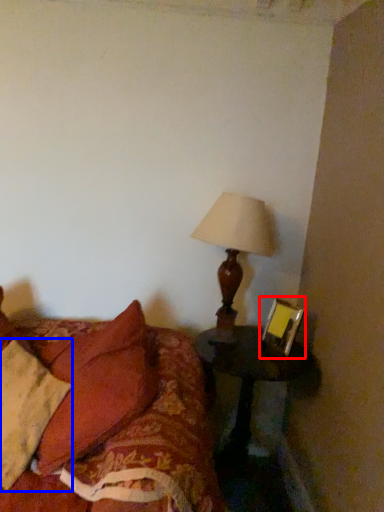
Question: Which object appears farthest to the camera in this image, picture frame (highlighted by a red box) or pillow (highlighted by a blue box)?

Choices:
 (A) picture frame
 (B) pillow

Answer: (A)